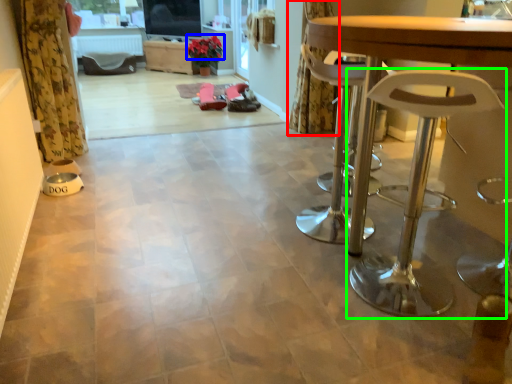
Question: Which object is positioned farthest from curtain (highlighted by a red box)? Select from flower (highlighted by a blue box) and stool (highlighted by a green box).

Choices:
 (A) flower
 (B) stool

Answer: (A)